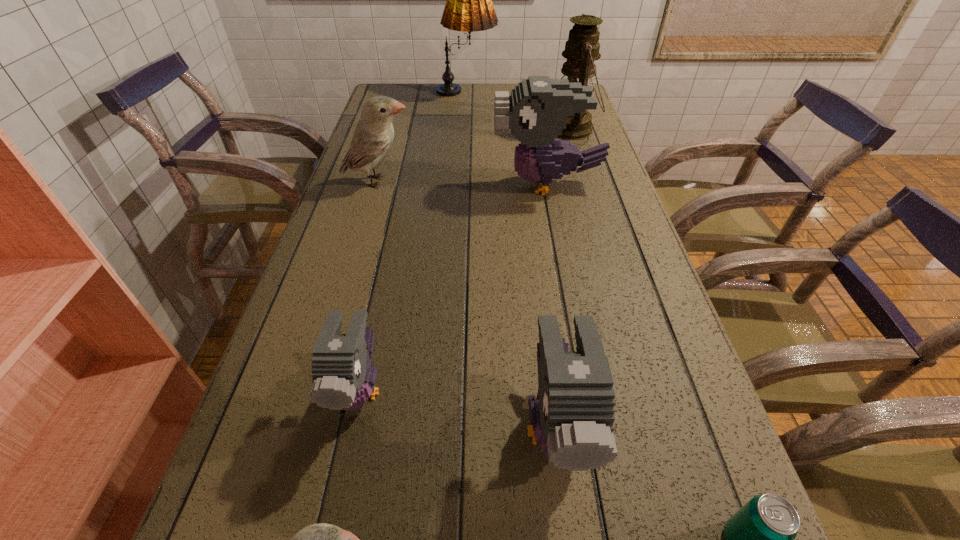
Find the location of `unoccupied area between the bigger white bird and the farthest gray bird`. unoccupied area between the bigger white bird and the farthest gray bird is located at coordinates (463, 183).

You are a GUI agent. You are given a task and a screenshot of the screen. Output one action in this format:
    pyautogui.click(x=<x>, y=<y>)
    Task: Click on the free spot between the bigger white bird and the smallest gray bird
    
    Given the screenshot: What is the action you would take?
    (x=369, y=285)

Where is `free area in between the second biggest gray bird and the bigger white bird`? This screenshot has height=540, width=960. free area in between the second biggest gray bird and the bigger white bird is located at coordinates (467, 304).

Identify the location of free space between the leftmost gray bird and the second smallest gray bird. (457, 408).

In order to click on object that is the second closest to the biggest gray bird in this screenshot , I will do `click(373, 137)`.

Choose which object is the fifth nearest neighbor to the green oil lamp. Please provide its 2D coordinates. Your answer should be formatted as a tuple, i.e. [(x, y)], where the tuple contains the x and y coordinates of a point satisfying the conditions above.

[(343, 379)]

Identify the location of bird that is the closest to the nearer white bird. This screenshot has width=960, height=540. (343, 379).

Identify which bird is the fourth closest to the farthest gray bird. Please provide its 2D coordinates. Your answer should be formatted as a tuple, i.e. [(x, y)], where the tuple contains the x and y coordinates of a point satisfying the conditions above.

[(321, 539)]

You are a GUI agent. You are given a task and a screenshot of the screen. Output one action in this format:
    pyautogui.click(x=<x>, y=<y>)
    Task: Click on the closest gray bird to the leftmost gray bird
    This screenshot has width=960, height=540.
    Given the screenshot: What is the action you would take?
    pyautogui.click(x=572, y=420)

Locate an element on the screen. gray bird that stands as the third closest to the beer can is located at coordinates (536, 112).